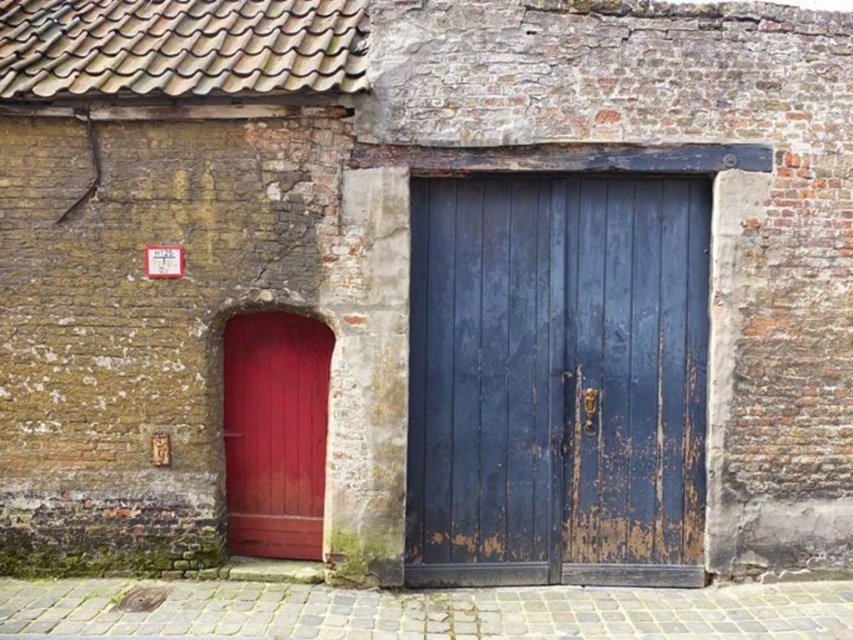
Does rusty wood door at center have a lesser width compared to smooth glossy red door at left?

No.

Between point (578, 177) and point (271, 316), which one is positioned behind?

The point (271, 316) is behind.

This screenshot has height=640, width=853. I want to click on rusty wood door at center, so click(x=556, y=380).